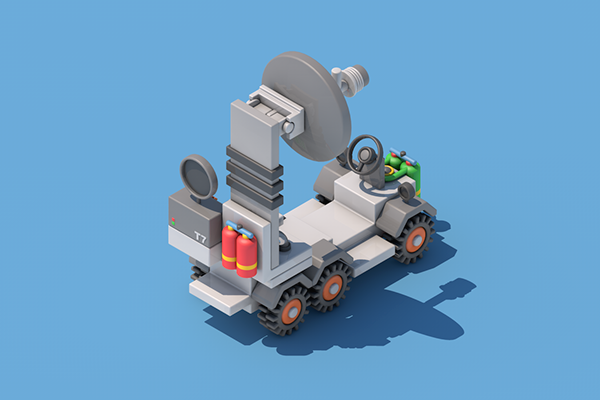
The height and width of the screenshot is (400, 600). What are the coordinates of `grey bracket holding dish` in the screenshot? It's located at (283, 105).